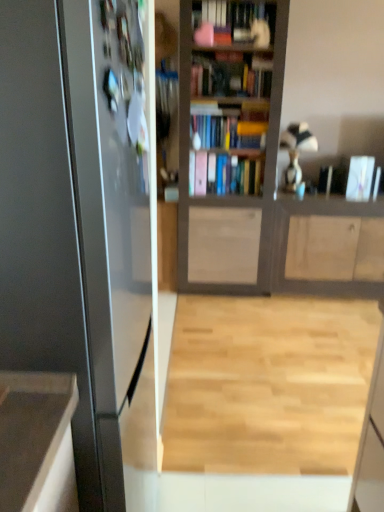
Question: Is light wood floor at center taller or shorter than metallic refrigerator at left?

Choices:
 (A) short
 (B) tall

Answer: (A)

Question: From the image's perspective, is light wood floor at center located above or below metallic refrigerator at left?

Choices:
 (A) below
 (B) above

Answer: (A)

Question: Which of these objects is positioned farthest from the white glossy book at upper right, which is the 1th book from right to left?

Choices:
 (A) wooden cabinet at center
 (B) metallic refrigerator at left
 (C) pink matte book at center, which is counted as the first book, starting from the left
 (D) wooden bookcase at center
 (E) light wood floor at center

Answer: (B)

Question: Estimate the real-world distances between objects in this image. Which object is closer to the pink matte book at center, which is counted as the first book, starting from the left?

Choices:
 (A) light wood floor at center
 (B) wooden cabinet at center
 (C) white glossy book at upper right, which is the 2th book from left to right
 (D) metallic refrigerator at left
 (E) wooden bookcase at center

Answer: (E)